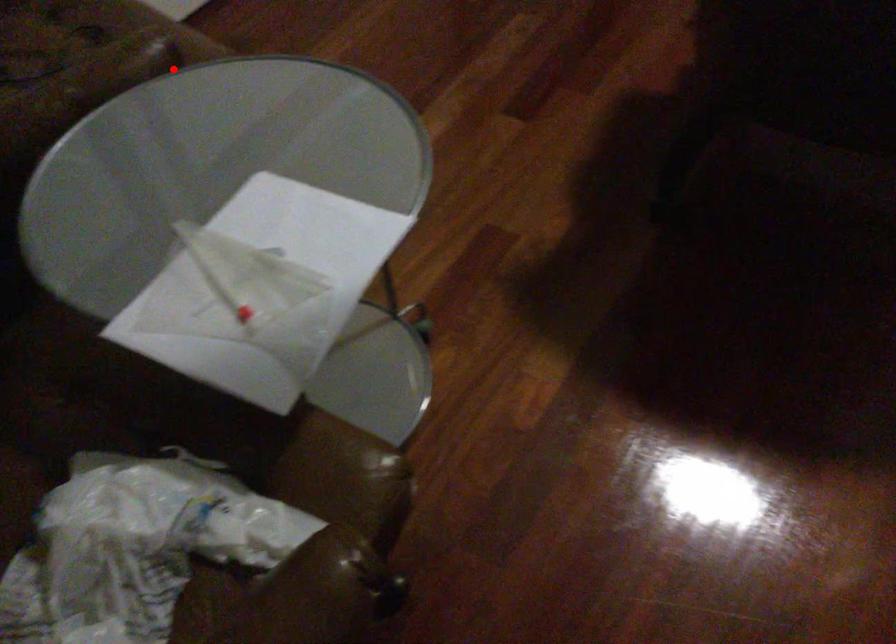
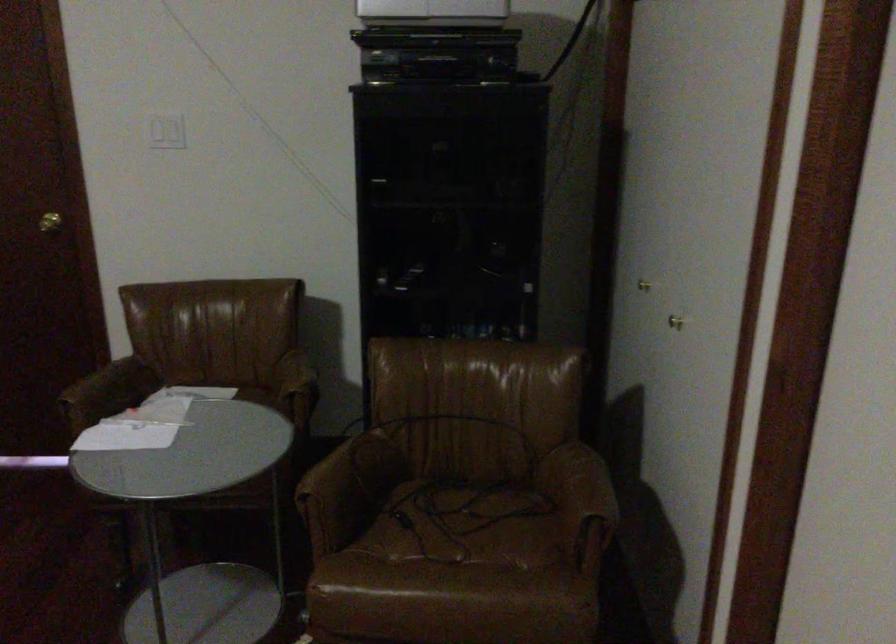
Find the pixel in the second image that matches the highlighted location in the first image.

(312, 513)